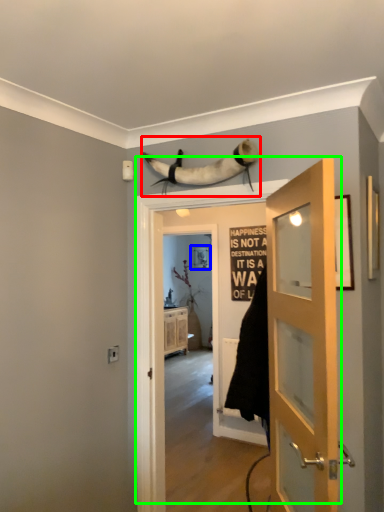
Question: Which object is positioned closest to animal (highlighted by a red box)? Select from picture frame (highlighted by a blue box) and door (highlighted by a green box).

Choices:
 (A) picture frame
 (B) door

Answer: (B)